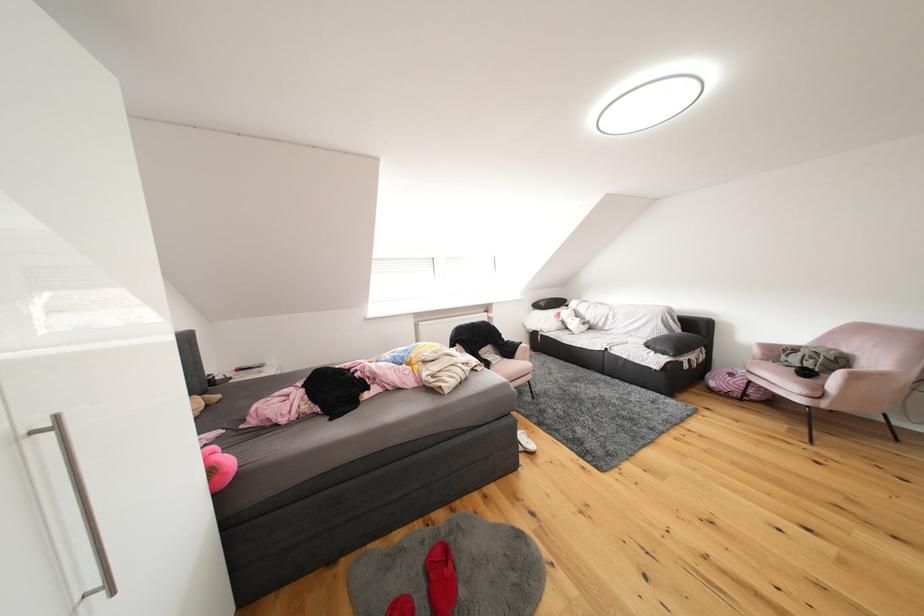
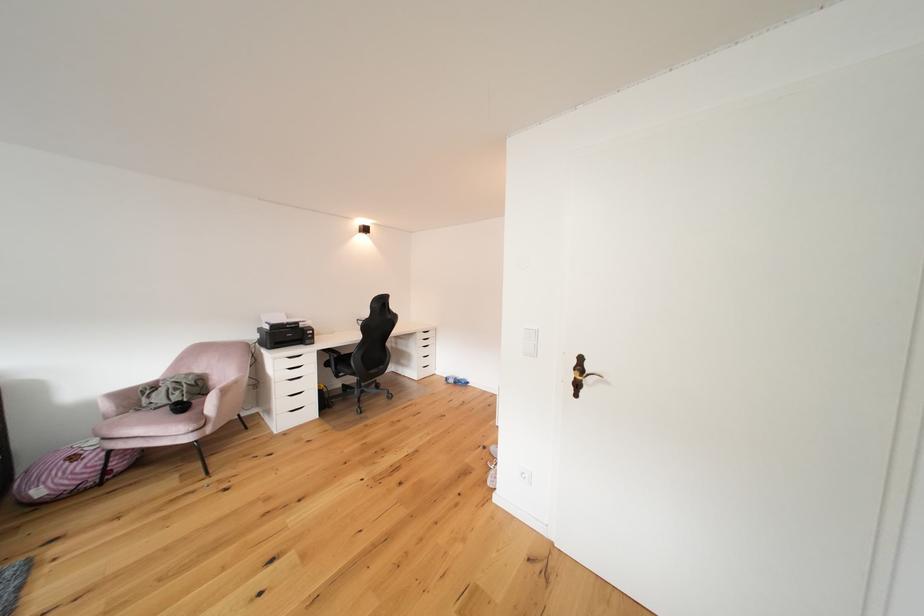
Question: Based on the continuous images, in which direction is the camera rotating? Reply with the corresponding letter.

Choices:
 (A) Left
 (B) Right
 (C) Up
 (D) Down

Answer: (B)